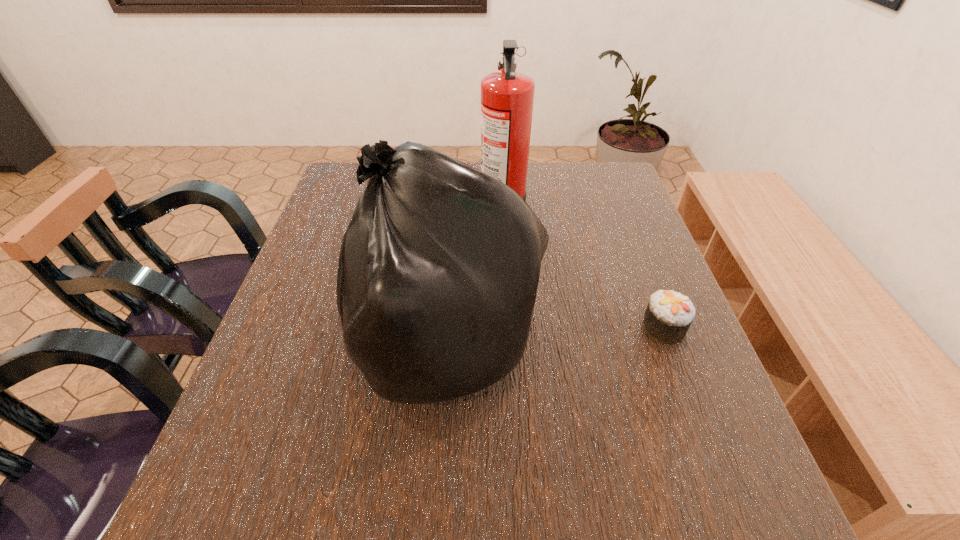
Identify the location of vacant position in the image that satisfies the following two spatial constraints: 1. on the front-facing side of the farthest object; 2. on the front side of the plastic bag. (511, 340).